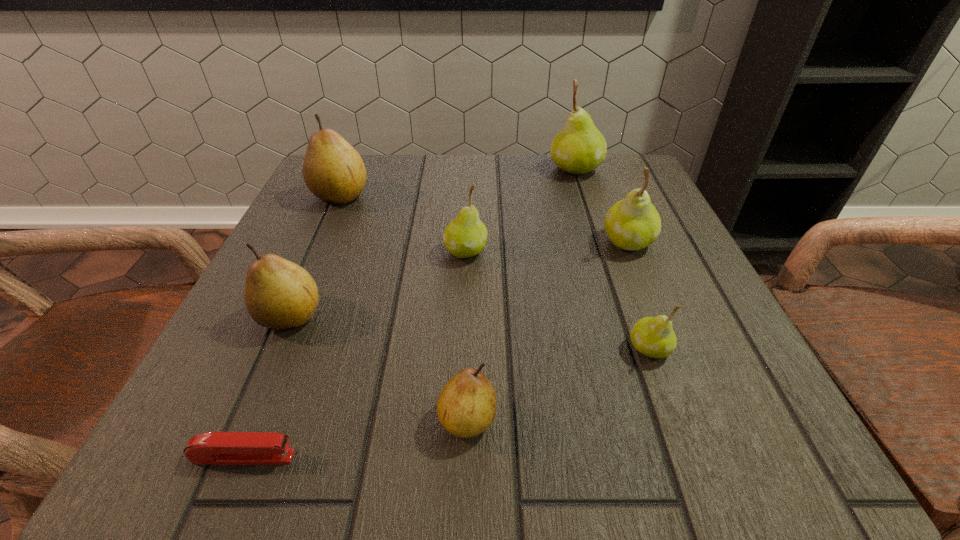
Where is `the nearest object`? The height and width of the screenshot is (540, 960). the nearest object is located at coordinates (218, 448).

Where is `blank area located on the front of the biggest green pear`? The height and width of the screenshot is (540, 960). blank area located on the front of the biggest green pear is located at coordinates (592, 220).

This screenshot has height=540, width=960. In order to click on free space located 0.390m on the front of the biggest brown pear in this screenshot , I will do point(264,369).

At what (x,y) coordinates should I click in order to perform the action: click on free spot located 0.400m on the left of the third smallest green pear. Please return your answer as a coordinate pair (x, y). The width and height of the screenshot is (960, 540). Looking at the image, I should click on (386, 241).

I want to click on vacant area situated on the back of the second farthest brown pear, so click(341, 201).

This screenshot has width=960, height=540. I want to click on vacant space located on the back of the second smallest green pear, so click(x=468, y=184).

This screenshot has height=540, width=960. Find the location of `vacant space positioned 0.400m on the back of the smallest green pear`. vacant space positioned 0.400m on the back of the smallest green pear is located at coordinates (592, 192).

Find the location of a particular element. This screenshot has width=960, height=540. vacant space located on the left of the smallest brown pear is located at coordinates (278, 418).

This screenshot has width=960, height=540. What are the coordinates of `vacant space located on the front-facing side of the stapler` in the screenshot? It's located at (619, 456).

Where is `pear present at the near edge`? This screenshot has height=540, width=960. pear present at the near edge is located at coordinates (466, 407).